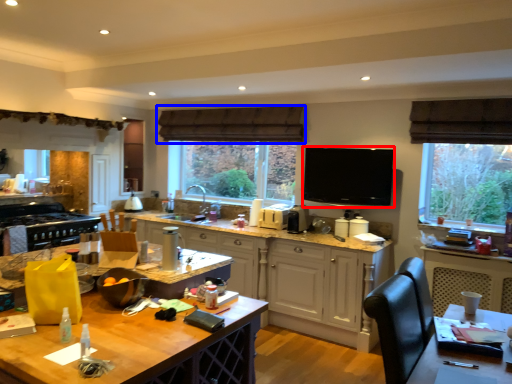
Question: Which object is closer to the camera taking this photo, appliance (highlighted by a red box) or exhaust hood (highlighted by a blue box)?

Choices:
 (A) appliance
 (B) exhaust hood

Answer: (A)